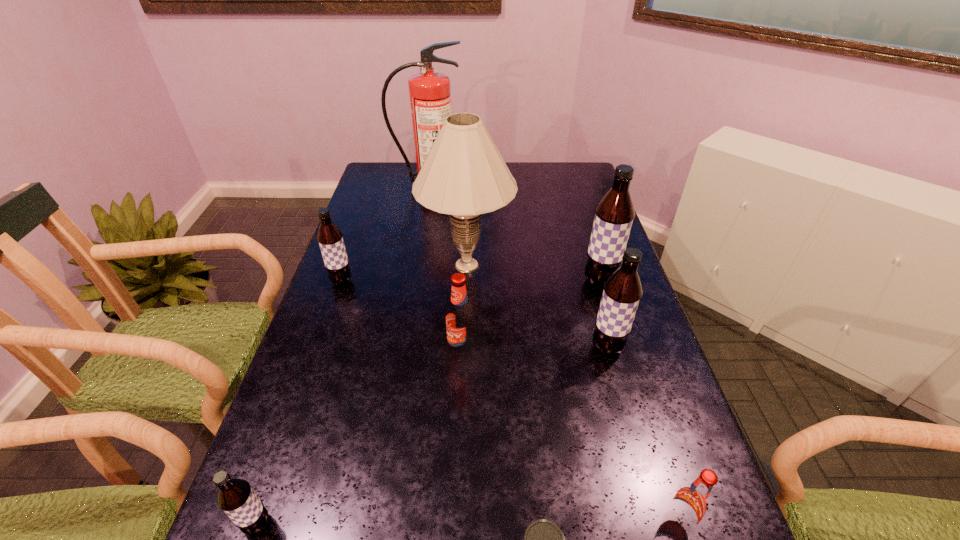
Select which brown root beer is the closest to the smaller red root beer. Please provide its 2D coordinates. Your answer should be formatted as a tuple, i.e. [(x, y)], where the tuple contains the x and y coordinates of a point satisfying the conditions above.

[(622, 292)]

The height and width of the screenshot is (540, 960). I want to click on brown root beer that stands as the closest to the left red root beer, so click(622, 292).

This screenshot has width=960, height=540. I want to click on free region that satisfies the following two spatial constraints: 1. on the front-facing side of the tallest root beer; 2. on the left side of the fire extinguisher, so click(x=412, y=281).

Find the location of `vacant region that satisfies the following two spatial constraints: 1. on the front-facing side of the left red root beer; 2. on the left side of the farthest object`. vacant region that satisfies the following two spatial constraints: 1. on the front-facing side of the left red root beer; 2. on the left side of the farthest object is located at coordinates (399, 351).

Where is `vacant space that satisfies the following two spatial constraints: 1. on the back side of the lampshade; 2. on the left side of the bigger red root beer`? vacant space that satisfies the following two spatial constraints: 1. on the back side of the lampshade; 2. on the left side of the bigger red root beer is located at coordinates (465, 265).